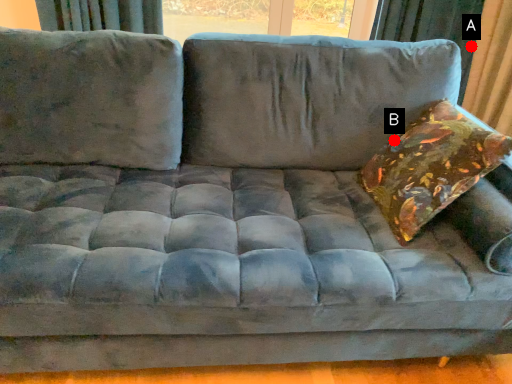
Question: Two points are circled on the image, labeled by A and B beside each circle. Among these points, which one is farthest from the camera?

Choices:
 (A) A is further
 (B) B is further

Answer: (A)